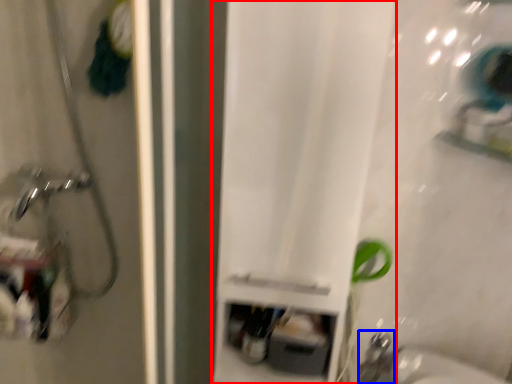
Question: Among these objects, which one is farthest to the camera, curtain (highlighted by a red box) or faucet (highlighted by a blue box)?

Choices:
 (A) curtain
 (B) faucet

Answer: (B)